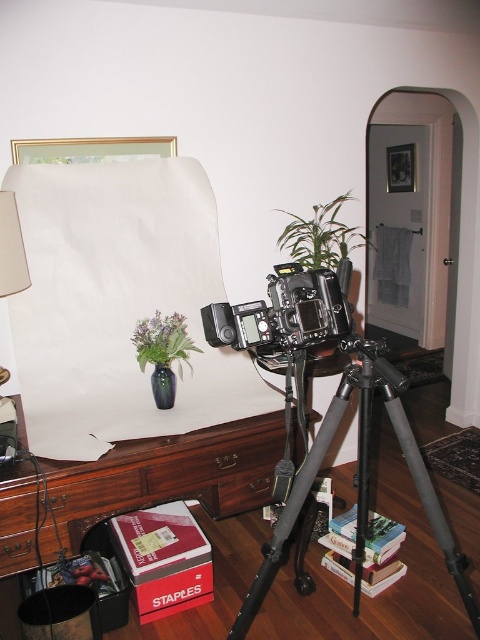
Question: Does brown wood table at center appear under gold metallic picture frame at upper center?

Choices:
 (A) yes
 (B) no

Answer: (A)

Question: Is gold metallic picture frame at upper center below green matte vase at center?

Choices:
 (A) no
 (B) yes

Answer: (A)

Question: Does beige fabric lampshade at upper left have a larger size compared to gold metallic picture frame at upper right?

Choices:
 (A) no
 (B) yes

Answer: (A)

Question: Which object is the farthest from the gold metallic picture frame at upper center?

Choices:
 (A) brown wood table at center
 (B) white paper at center

Answer: (A)

Question: Estimate the real-world distances between objects in this image. Which object is farther from the gold metallic picture frame at upper center?

Choices:
 (A) black metal tripod at center
 (B) white paper at center
 (C) green matte vase at center

Answer: (A)

Question: Which of the following is the closest to the observer?

Choices:
 (A) gold metallic picture frame at upper center
 (B) green matte vase at center
 (C) black metallic camera at center
 (D) brown wood table at center

Answer: (C)